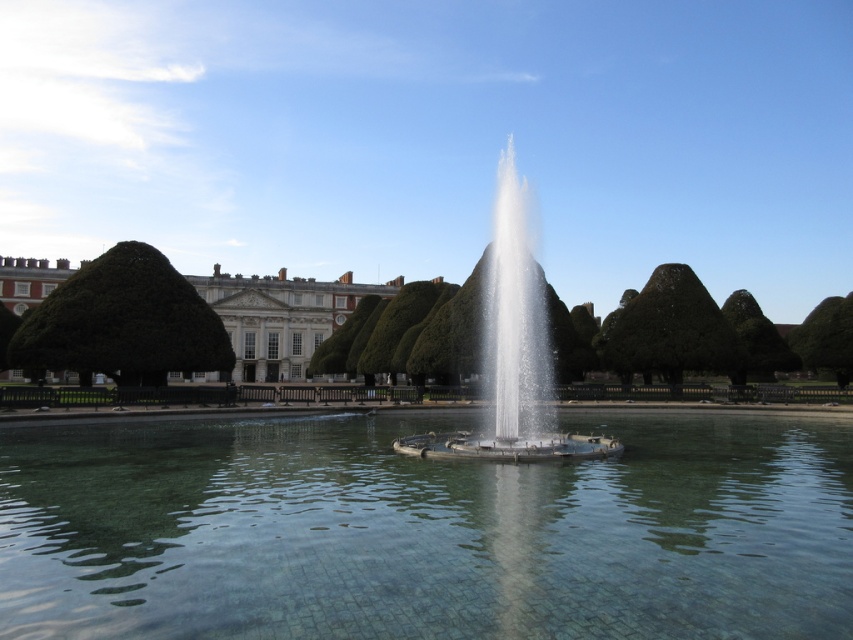
Question: Where is clear glass fountain at center located in relation to green leafy tree at right in the image?

Choices:
 (A) right
 (B) left

Answer: (B)

Question: Estimate the real-world distances between objects in this image. Which object is closer to the green textured hedge at upper right?

Choices:
 (A) green leafy tree at upper right
 (B) clear glass water at center
 (C) white glossy palace at center

Answer: (A)

Question: Is clear glass water at center thinner than green leafy tree at left?

Choices:
 (A) yes
 (B) no

Answer: (B)

Question: Which object is farther from the camera taking this photo?

Choices:
 (A) green leafy tree at left
 (B) clear glass fountain at center
 (C) green leafy tree at right
 (D) white glossy palace at center

Answer: (C)

Question: Which of the following is the closest to the observer?

Choices:
 (A) (850, 316)
 (B) (778, 596)
 (C) (508, 323)
 (D) (618, 346)

Answer: (B)

Question: Does clear glass water at center lie in front of white glossy palace at center?

Choices:
 (A) yes
 (B) no

Answer: (A)